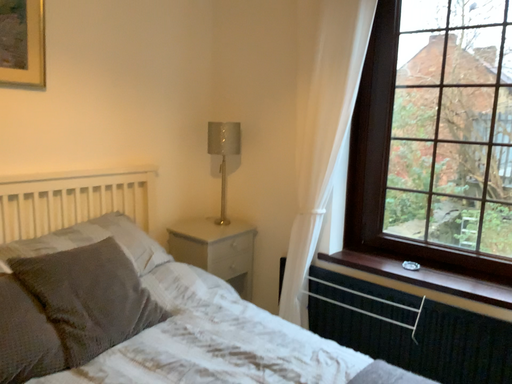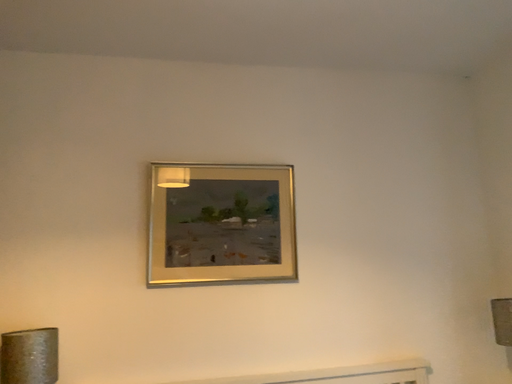
Question: How did the camera likely rotate when shooting the video?

Choices:
 (A) rotated right
 (B) rotated left

Answer: (B)